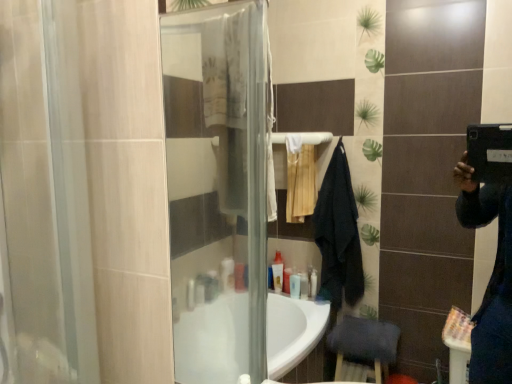
Locate an element on the screen. The height and width of the screenshot is (384, 512). transparent plastic screen door at left is located at coordinates (46, 193).

This screenshot has width=512, height=384. Describe the element at coordinates (46, 193) in the screenshot. I see `transparent plastic screen door at left` at that location.

Identify the location of transparent plastic screen door at left. The height and width of the screenshot is (384, 512). (46, 193).